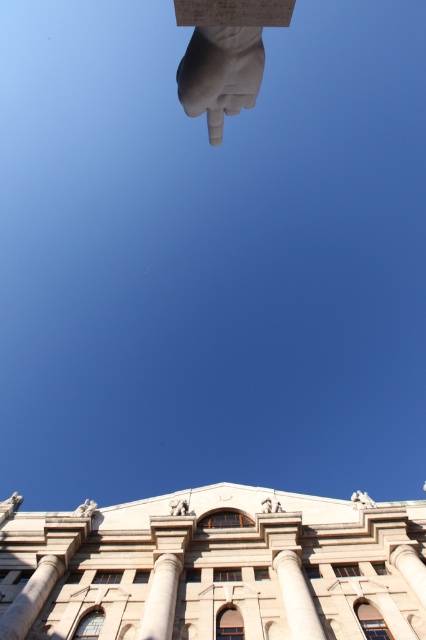
Is point (227, 42) positioned in front of point (161, 564)?

Yes, point (227, 42) is closer to viewer.

How far apart are white marble hand at upper center and white marble pillar at center?

24.73 meters

Is point (196, 61) behind point (166, 577)?

No, it is not.

I want to click on white marble hand at upper center, so click(x=219, y=74).

Is white marble column at center to the left of white stone lion at upper left from the viewer's perspective?

In fact, white marble column at center is to the right of white stone lion at upper left.

Is white marble column at center taller than white stone lion at upper left?

No, white marble column at center is not taller than white stone lion at upper left.

Image resolution: width=426 pixels, height=640 pixels. I want to click on white marble column at center, so click(296, 596).

In order to click on white marble hand at upper center in this screenshot , I will do `click(219, 74)`.

Is white marble hand at upper center to the left of white marble column at center from the viewer's perspective?

Yes, white marble hand at upper center is to the left of white marble column at center.

Does point (226, 56) lie in front of point (299, 588)?

Yes, it is in front of point (299, 588).

The width and height of the screenshot is (426, 640). I want to click on white marble hand at upper center, so click(x=219, y=74).